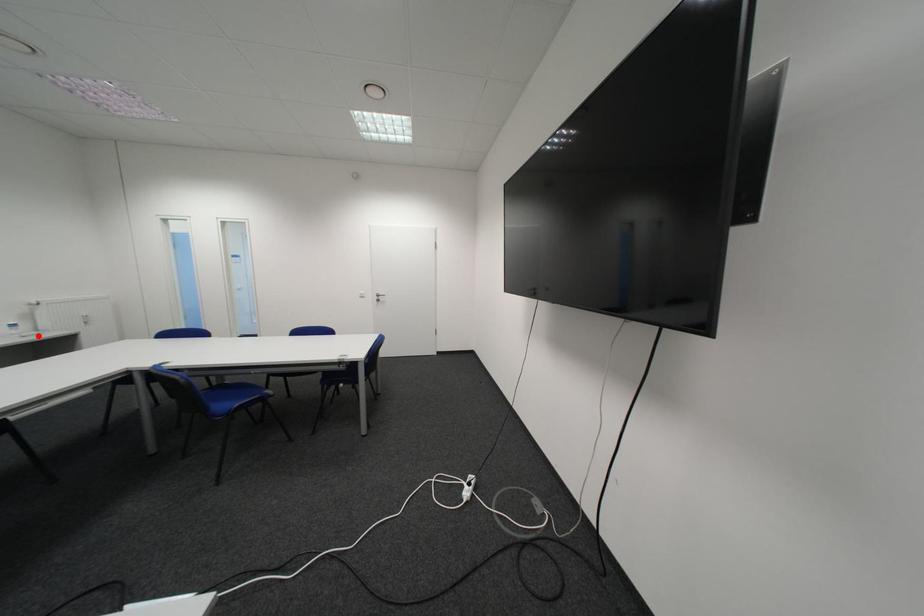
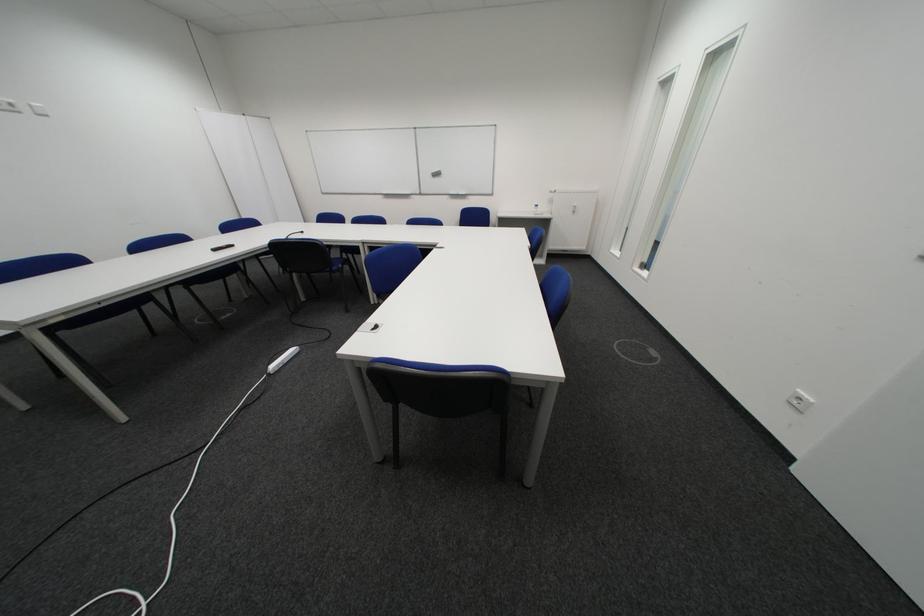
Question: I am providing you with two images of the same scene from different viewpoints. A red point is marked on the first image. At the location where the point appears in image 1, is it still visible in image 2?

Choices:
 (A) Yes
 (B) No

Answer: (A)